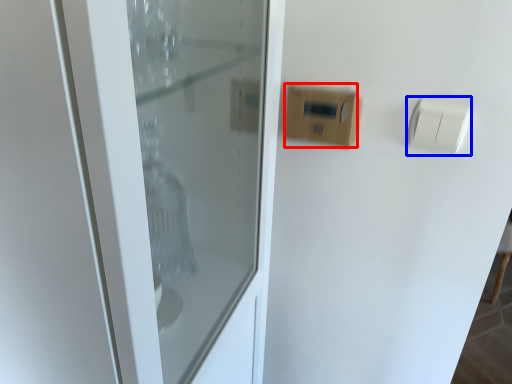
Question: Which point is further to the camera, light switch (highlighted by a red box) or light switch (highlighted by a blue box)?

Choices:
 (A) light switch
 (B) light switch

Answer: (A)